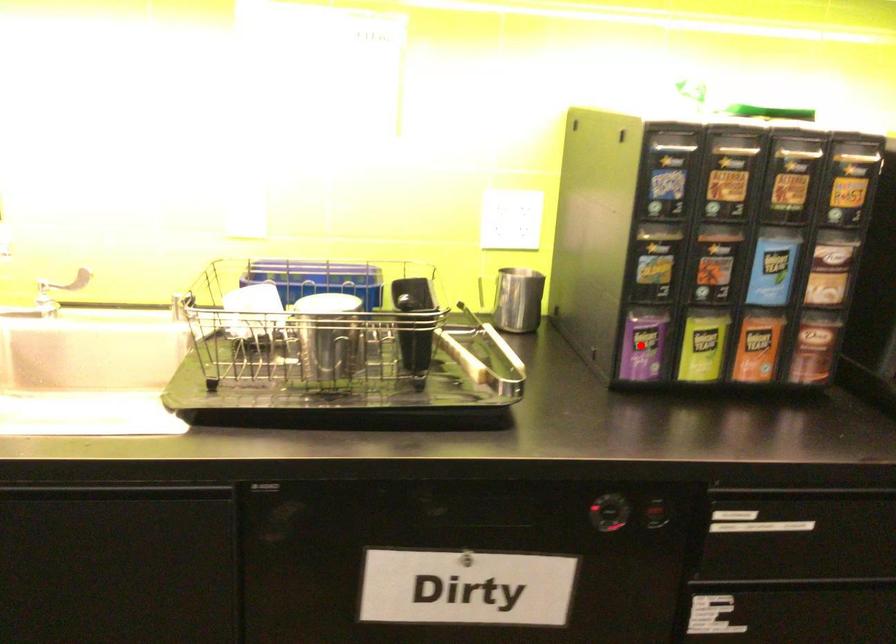
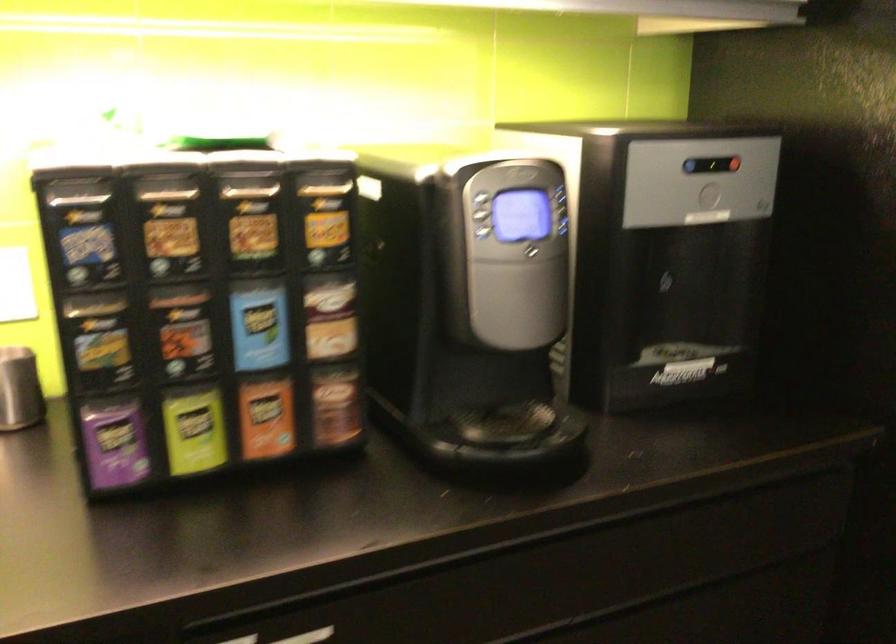
Locate, in the second image, the point that corresponds to the highlighted location in the first image.

(114, 442)